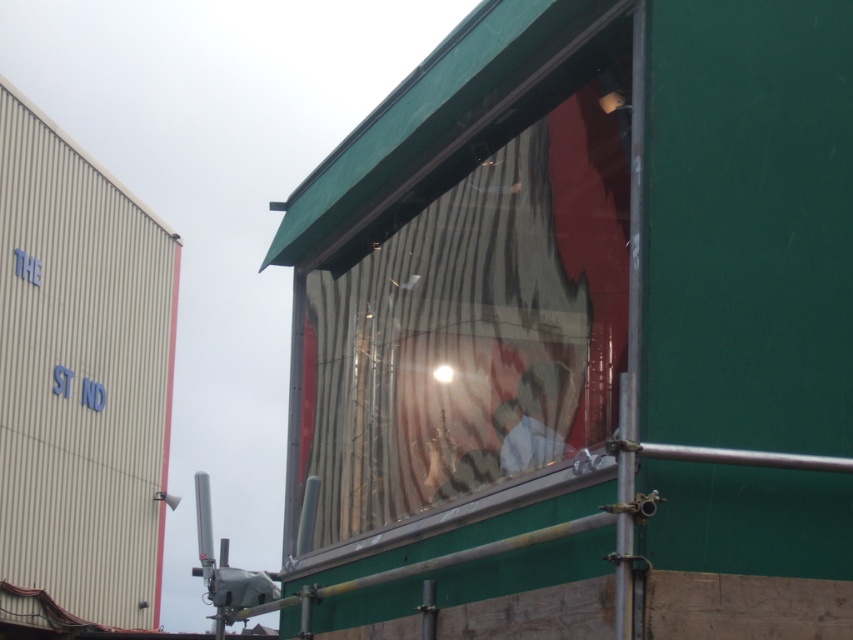
You are standing at the entrance of the construction site and want to locate the transparent glass window at center. According to the coordinates provided, where exactly should you look to find it?

Result: The transparent glass window at center is located at coordinates point (460, 264).

You are standing outside the building looking at the construction site. You notice the transparent glass window at center and the white fabric at center. Which object is higher up in the scene?

The transparent glass window at center is located above the white fabric at center, so it is higher up in the scene.